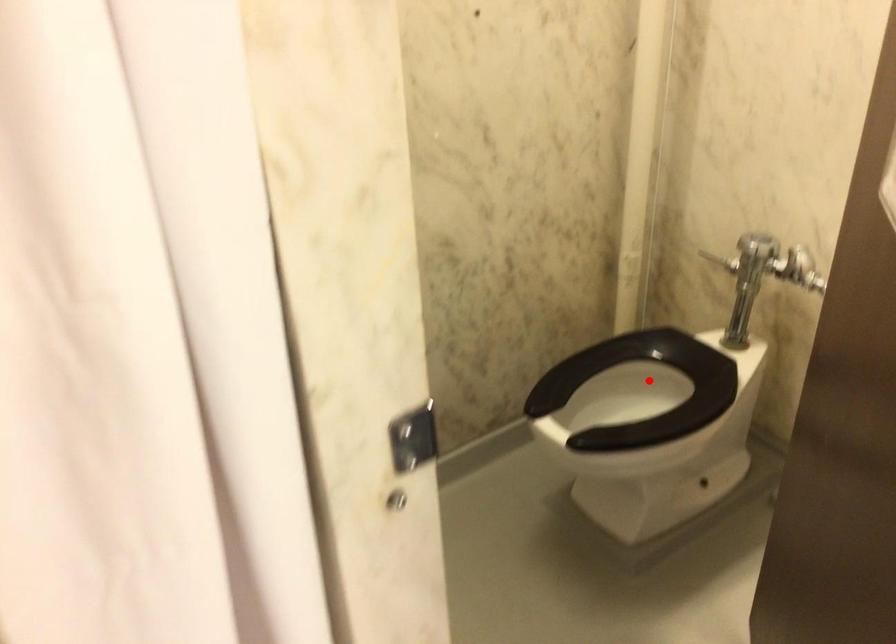
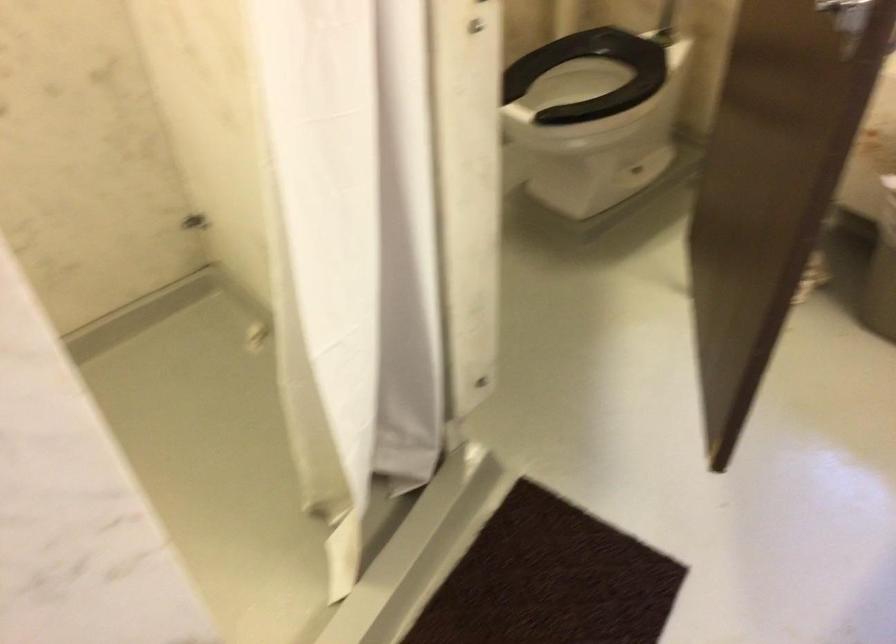
Question: A red point is marked in image1. In image2, is the corresponding 3D point closer to the camera or farther? Reply with the corresponding letter.

Choices:
 (A) The corresponding 3D point is closer.
 (B) The corresponding 3D point is farther.

Answer: (B)